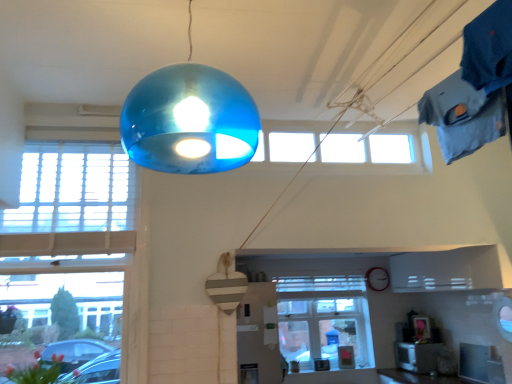
Question: Is the depth of clear glass window at center, arranged as the 3th window when viewed from the front, greater than that of transparent glass window at upper center, placed as the 2th window when sorted from right to left?

Choices:
 (A) no
 (B) yes

Answer: (B)

Question: Does clear glass window at center, arranged as the 3th window when viewed from the front, have a larger size compared to transparent glass window at upper center, which ranks as the 2th window in back-to-front order?

Choices:
 (A) yes
 (B) no

Answer: (A)

Question: Is clear glass window at center, arranged as the 3th window when viewed from the front, taller than transparent glass window at upper center, placed as the 2th window when sorted from right to left?

Choices:
 (A) yes
 (B) no

Answer: (A)

Question: Can you confirm if clear glass window at center, the first window from the back, is positioned to the right of transparent glass window at upper center, which ranks as the 2th window in back-to-front order?

Choices:
 (A) no
 (B) yes

Answer: (B)

Question: Is clear glass window at center, which ranks as the first window in right-to-left order, aimed at transparent glass window at upper center, placed as the 2th window when sorted from right to left?

Choices:
 (A) no
 (B) yes

Answer: (A)

Question: Is clear glass window at center, which is the 3th window in left-to-right order, smaller than transparent glass window at upper center, arranged as the second window when viewed from the front?

Choices:
 (A) yes
 (B) no

Answer: (B)

Question: Is clear glass window at center, the first window from the back, facing away from vivid pink petals at lower left?

Choices:
 (A) yes
 (B) no

Answer: (B)

Question: Does clear glass window at center, arranged as the 3th window when viewed from the front, have a greater height compared to vivid pink petals at lower left?

Choices:
 (A) yes
 (B) no

Answer: (A)

Question: Considering the relative positions of clear glass window at center, arranged as the 3th window when viewed from the front, and vivid pink petals at lower left in the image provided, is clear glass window at center, arranged as the 3th window when viewed from the front, in front of vivid pink petals at lower left?

Choices:
 (A) yes
 (B) no

Answer: (B)

Question: Can you confirm if clear glass window at center, arranged as the 3th window when viewed from the front, is thinner than vivid pink petals at lower left?

Choices:
 (A) yes
 (B) no

Answer: (A)

Question: Considering the relative positions of clear glass window at center, arranged as the 3th window when viewed from the front, and vivid pink petals at lower left in the image provided, is clear glass window at center, arranged as the 3th window when viewed from the front, to the left of vivid pink petals at lower left from the viewer's perspective?

Choices:
 (A) yes
 (B) no

Answer: (B)

Question: From the image's perspective, does clear glass window at center, arranged as the 3th window when viewed from the front, appear lower than vivid pink petals at lower left?

Choices:
 (A) yes
 (B) no

Answer: (A)

Question: Is vivid pink petals at lower left not inside white wooden window at left, which is the 1th window from left to right?

Choices:
 (A) yes
 (B) no

Answer: (B)